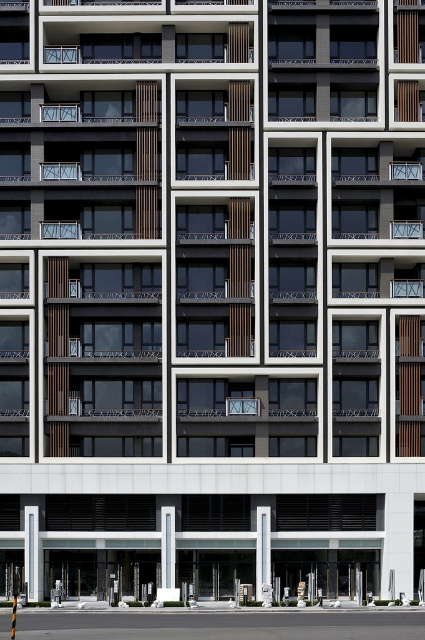
Question: Does white concrete pillar at center appear on the right side of white glossy pillar at center?

Choices:
 (A) yes
 (B) no

Answer: (A)

Question: Which point is closer to the camera?

Choices:
 (A) white concrete pillar at center
 (B) white glossy pillar at center

Answer: (A)

Question: Which of the following is the closest to the observer?

Choices:
 (A) (166, 545)
 (B) (263, 516)

Answer: (A)

Question: Can you confirm if white concrete pillar at center is positioned to the right of white glossy pillar at center?

Choices:
 (A) no
 (B) yes

Answer: (B)

Question: Which object appears closest to the camera in this image?

Choices:
 (A) white glossy pillar at center
 (B) white concrete pillar at center

Answer: (B)

Question: Is white concrete pillar at center bigger than white glossy pillar at center?

Choices:
 (A) yes
 (B) no

Answer: (A)